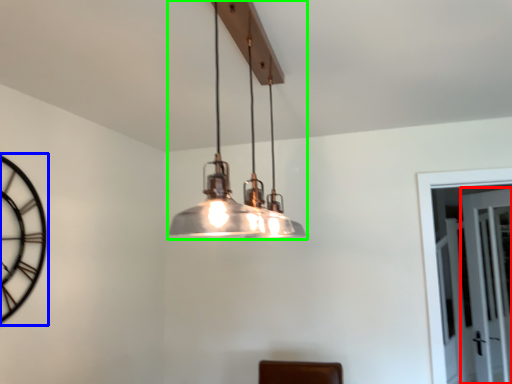
Question: Estimate the real-world distances between objects in this image. Which object is closer to glass door (highlighted by a red box), clock (highlighted by a blue box) or lamp (highlighted by a green box)?

Choices:
 (A) clock
 (B) lamp

Answer: (B)